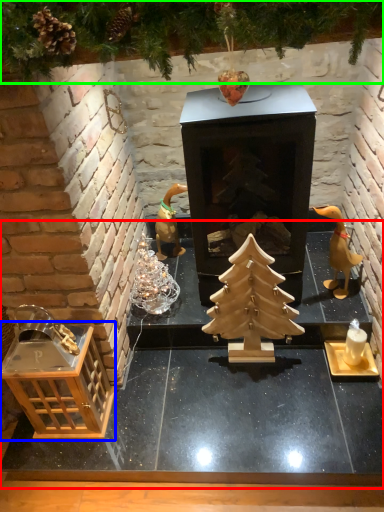
Question: Considering the real-world distances, which object is closest to table (highlighted by a red box)? crate (highlighted by a blue box) or tree (highlighted by a green box).

Choices:
 (A) crate
 (B) tree

Answer: (A)